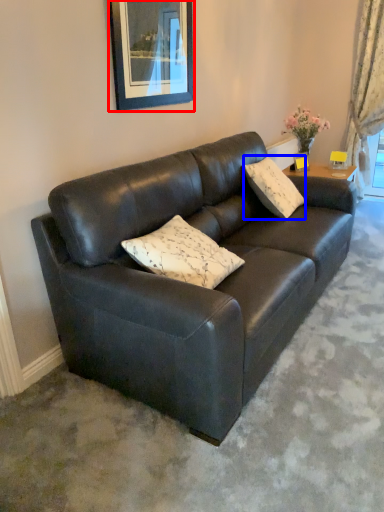
Question: Which point is further to the camera, picture frame (highlighted by a red box) or pillow (highlighted by a blue box)?

Choices:
 (A) picture frame
 (B) pillow

Answer: (B)